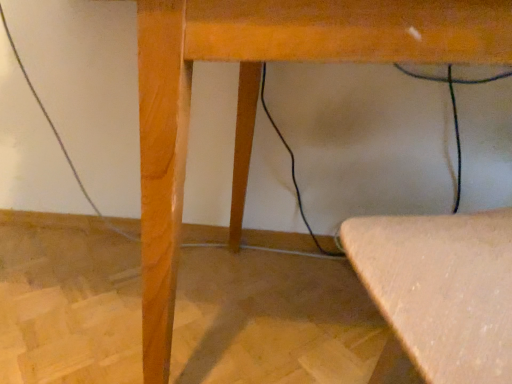
This screenshot has height=384, width=512. What do you see at coordinates (257, 94) in the screenshot?
I see `wooden table at center` at bounding box center [257, 94].

Image resolution: width=512 pixels, height=384 pixels. I want to click on wooden table at center, so click(257, 94).

Image resolution: width=512 pixels, height=384 pixels. What are the coordinates of `wooden table at center` in the screenshot? It's located at point(257,94).